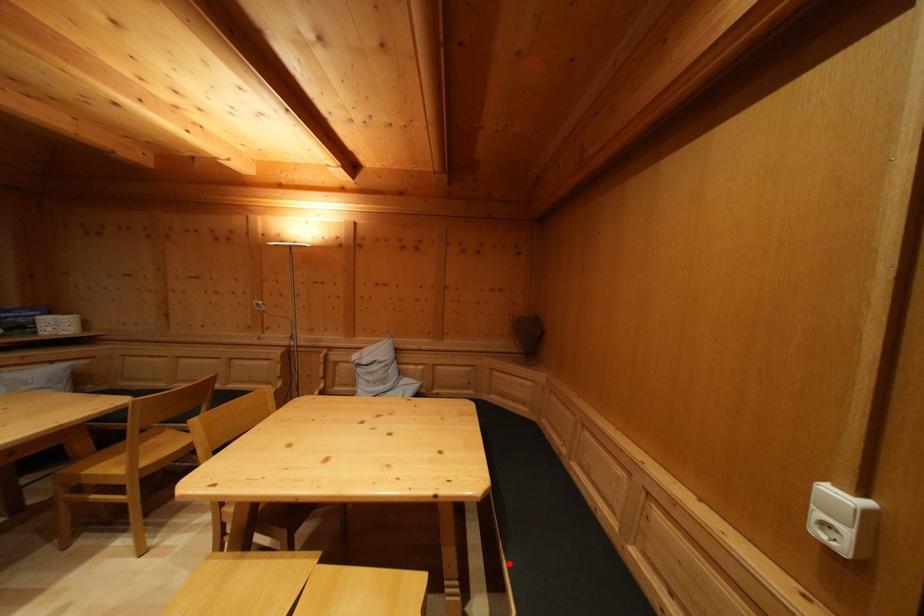
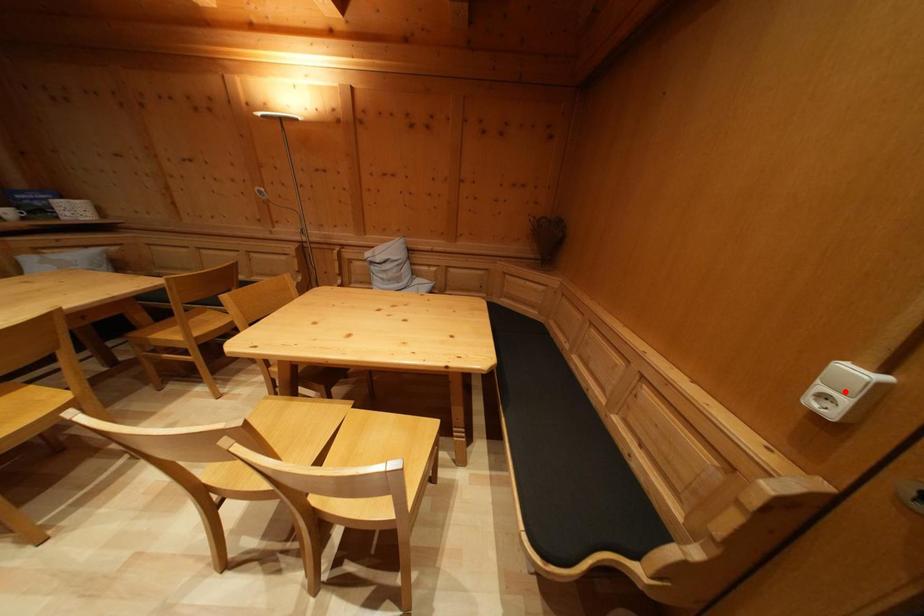
I am providing you with two images of the same scene from different viewpoints. A red point is marked on the first image and another point is marked on the second image. Do the highlighted points in image1 and image2 indicate the same real-world spot?

No